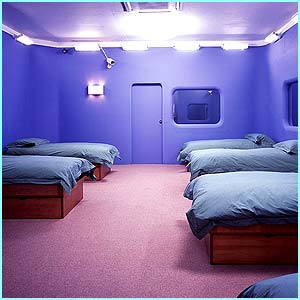
Identify the location of bed. (201, 141).